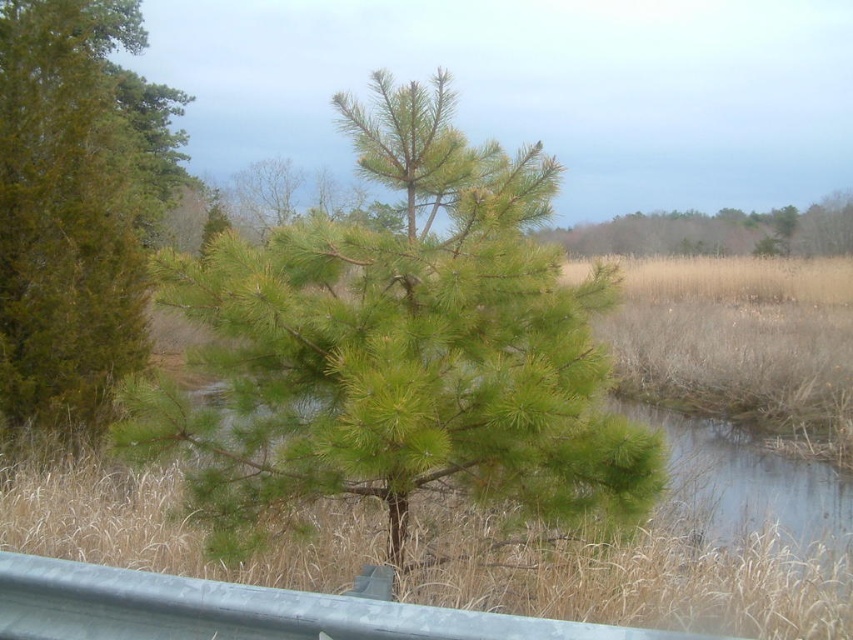
Question: Is green needle-like at left thinner than green needle-like tree at upper center?

Choices:
 (A) no
 (B) yes

Answer: (B)

Question: Is green needle-like at left behind green needle-like tree at upper center?

Choices:
 (A) no
 (B) yes

Answer: (A)

Question: Which point appears farthest from the camera in this image?

Choices:
 (A) (822, 243)
 (B) (73, 230)

Answer: (A)

Question: Among these objects, which one is farthest from the camera?

Choices:
 (A) green needle-like tree at center
 (B) green needle-like at left

Answer: (B)

Question: Can you confirm if green needle-like tree at center is smaller than green needle-like at left?

Choices:
 (A) no
 (B) yes

Answer: (B)

Question: Which point is farther to the camera?

Choices:
 (A) green needle-like at left
 (B) green needle-like tree at upper center
 (C) green needle-like tree at center

Answer: (B)